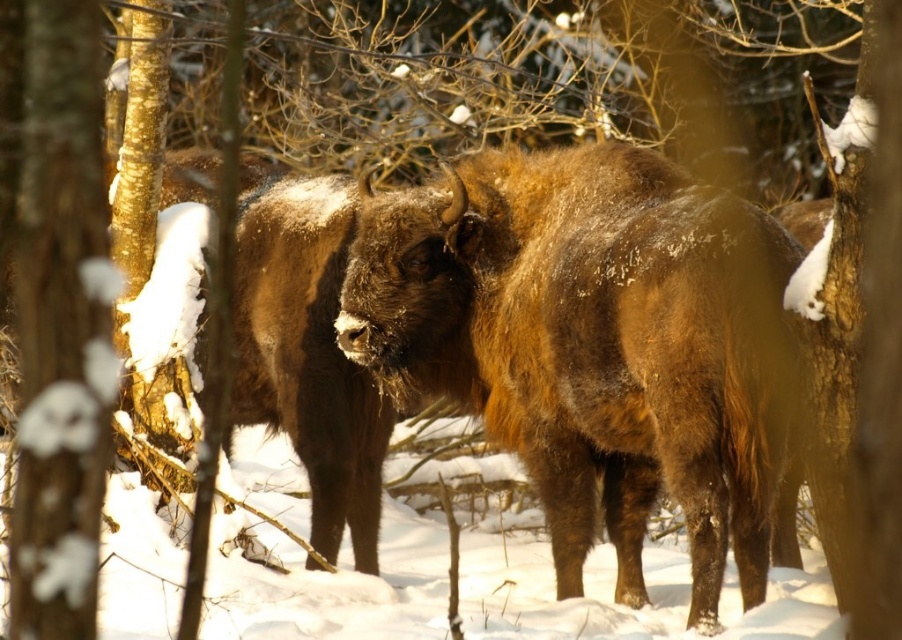
Is brown fuzzy yak at center in front of snow-covered bark at left?

No.

Measure the distance between point (695, 420) and camera.

Point (695, 420) is 13.50 feet from camera.

Which is in front, point (723, 433) or point (24, 285)?

Point (24, 285) is in front.

Locate an element on the screen. The width and height of the screenshot is (902, 640). brown fuzzy yak at center is located at coordinates (592, 342).